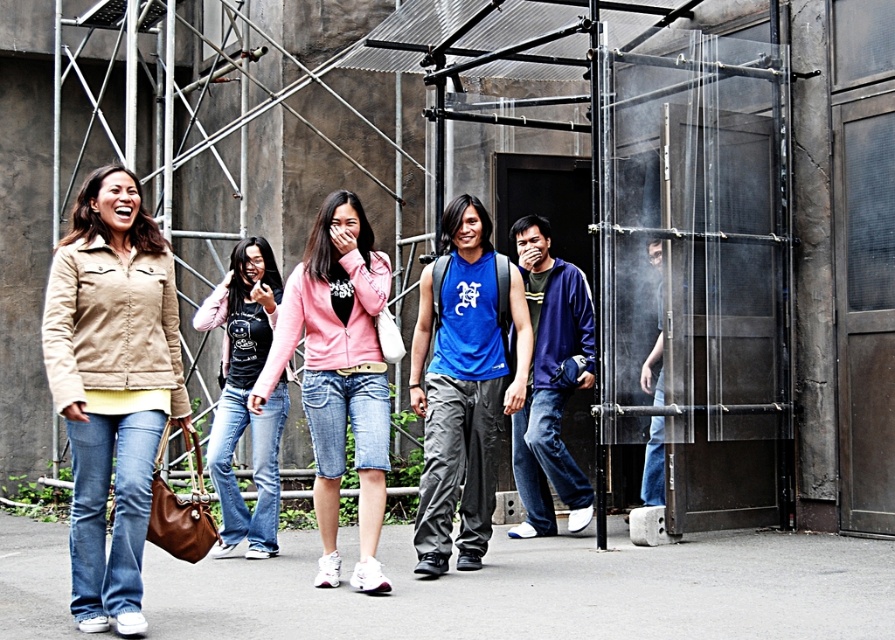
Question: Which of the following is the farthest from the observer?

Choices:
 (A) (655, 392)
 (B) (138, 413)

Answer: (A)

Question: Which of the following is the closest to the observer?

Choices:
 (A) beige suede jacket at left
 (B) black cotton shirt at center
 (C) dark blue shirt at center

Answer: (A)

Question: Is beige suede jacket at left wider than dark blue hoodie at center?

Choices:
 (A) no
 (B) yes

Answer: (B)

Question: Among these points, which one is farthest from the camera?

Choices:
 (A) (573, 337)
 (B) (226, 342)
 (C) (75, 605)
 (D) (363, 547)

Answer: (A)

Question: In this image, where is blue cotton tank top at center located relative to dark blue hoodie at center?

Choices:
 (A) below
 (B) above

Answer: (B)

Question: Is blue cotton tank top at center closer to the viewer compared to dark blue hoodie at center?

Choices:
 (A) no
 (B) yes

Answer: (B)